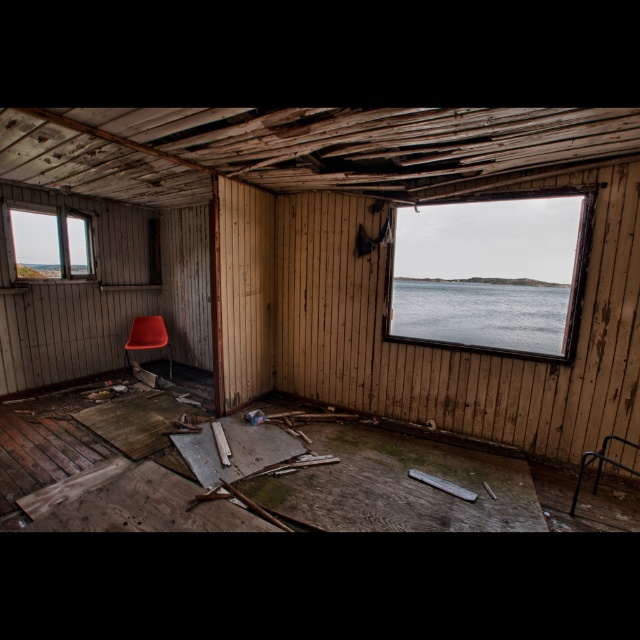
Can you confirm if matte plastic chair at center left is bigger than blue water at window right?

No, matte plastic chair at center left is not bigger than blue water at window right.

From the picture: Who is more distant from viewer, (179, 173) or (490, 288)?

The point (490, 288) is more distant.

Between point (596, 276) and point (419, 310), which one is positioned behind?

Point (419, 310)

You are a GUI agent. You are given a task and a screenshot of the screen. Output one action in this format:
    pyautogui.click(x=<x>, y=<y>)
    Task: Click on the matte plastic chair at center left
    This screenshot has width=640, height=640.
    Given the screenshot: What is the action you would take?
    pyautogui.click(x=323, y=257)

Who is more forward, (449,285) or (29,269)?

Point (29,269)

Describe the element at coordinates (481, 312) in the screenshot. Image resolution: width=640 pixels, height=640 pixels. I see `blue water at window right` at that location.

Locate an element on the screen. blue water at window right is located at coordinates (481, 312).

Is transparent glass window at upper left bigger than matte orange armchair at center?

Yes, transparent glass window at upper left is bigger than matte orange armchair at center.

Is point (12, 216) positioned before point (134, 330)?

No, (12, 216) is further to viewer.

Does point (92, 257) come farther from viewer compared to point (170, 360)?

No, (92, 257) is in front of (170, 360).

The image size is (640, 640). I want to click on transparent glass window at upper left, so click(51, 243).